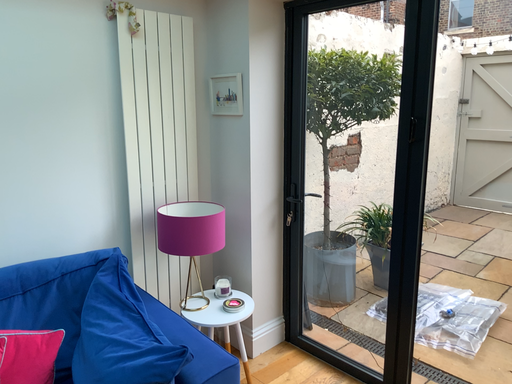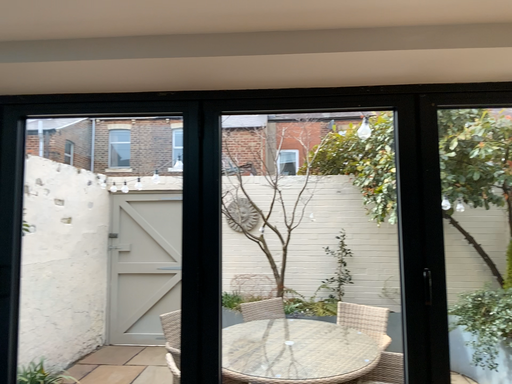
Question: Which way did the camera rotate in the video?

Choices:
 (A) rotated left
 (B) rotated right

Answer: (B)